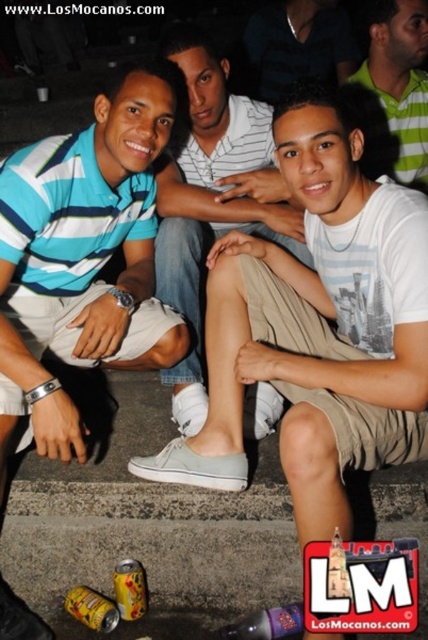
Question: Estimate the real-world distances between objects in this image. Which object is closer to the white cotton shirt at center?

Choices:
 (A) white canvas shoe at lower left
 (B) light brown fabric pants at center
 (C) blue striped polo shirt at left

Answer: (B)

Question: Does blue striped polo shirt at left have a greater width compared to light brown fabric pants at center?

Choices:
 (A) yes
 (B) no

Answer: (A)

Question: Which object appears farthest from the camera in this image?

Choices:
 (A) white cotton shirt at center
 (B) white canvas shoe at lower left

Answer: (A)

Question: Is white canvas shoe at lower left smaller than light brown fabric pants at center?

Choices:
 (A) no
 (B) yes

Answer: (A)

Question: Which point appears farthest from the camera in this image?

Choices:
 (A) (410, 77)
 (B) (53, 225)

Answer: (A)

Question: Is white canvas shoe at lower left positioned in front of white cotton shirt at center?

Choices:
 (A) no
 (B) yes

Answer: (B)